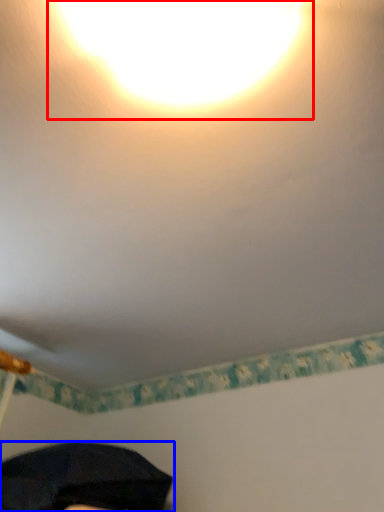
Question: Which object is further to the camera taking this photo, light (highlighted by a red box) or umbrella (highlighted by a blue box)?

Choices:
 (A) light
 (B) umbrella

Answer: (B)